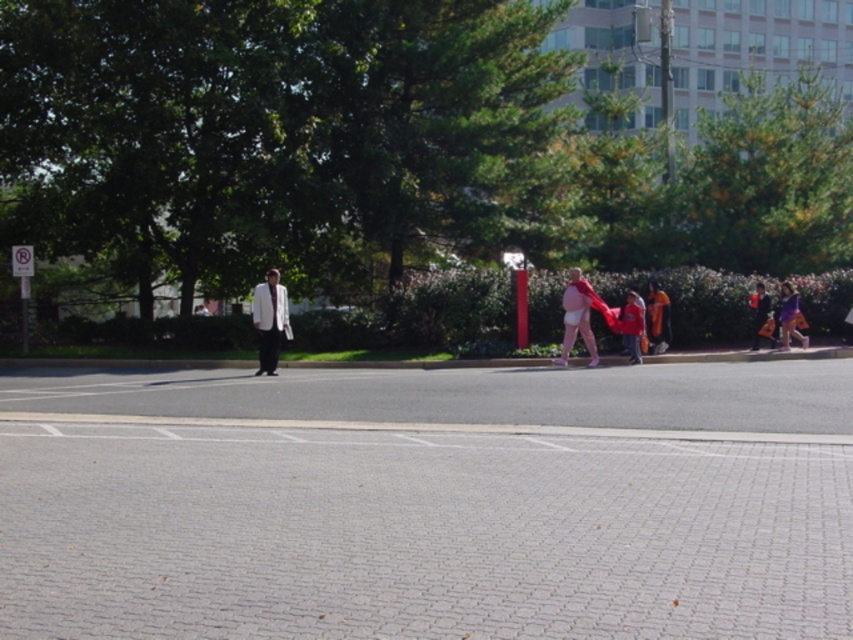
Question: Can you confirm if matte pink diaper at center is positioned above red cotton shirt at center?

Choices:
 (A) no
 (B) yes

Answer: (B)

Question: Which point is closer to the camera taking this photo?

Choices:
 (A) (563, 349)
 (B) (805, 324)
 (C) (62, 397)

Answer: (C)

Question: Does gray brick pavement at center have a greater width compared to light beige suit at center?

Choices:
 (A) yes
 (B) no

Answer: (A)

Question: Which point appears farthest from the camera in this image?

Choices:
 (A) 635,305
 (B) 656,307

Answer: (B)

Question: Which point is closer to the camera?

Choices:
 (A) matte pink diaper at center
 (B) denim jacket at lower right
 (C) gray brick pavement at center

Answer: (C)

Question: Is matte pink diaper at center above purple fabric bag at right?

Choices:
 (A) no
 (B) yes

Answer: (A)